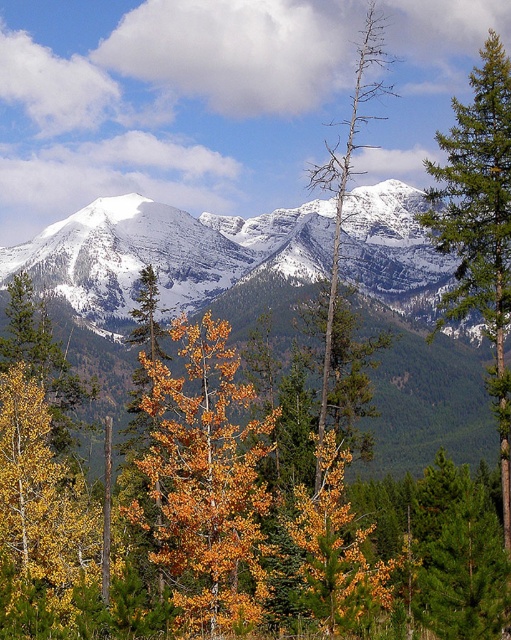
Between yellow leafy tree at center and bare wood tree at center, which one has less height?

Standing shorter between the two is yellow leafy tree at center.

Does yellow leafy tree at center appear on the right side of bare wood tree at center?

Incorrect, yellow leafy tree at center is not on the right side of bare wood tree at center.

Is point (208, 602) positioned after point (368, 120)?

That is False.

Where is `yellow leafy tree at center`? The image size is (511, 640). yellow leafy tree at center is located at coordinates (239, 502).

Can you confirm if yellow leafy tree at center is shorter than orange leafy tree at center?

No, yellow leafy tree at center is not shorter than orange leafy tree at center.

Which is below, yellow leafy tree at center or orange leafy tree at center?

yellow leafy tree at center is below.

Where is `yellow leafy tree at center`? This screenshot has width=511, height=640. yellow leafy tree at center is located at coordinates (239, 502).

Locate an element on the screen. The image size is (511, 640). yellow leafy tree at center is located at coordinates (239, 502).

Can you confirm if snowy granite mountains at center is positioned above green textured pine tree at right?

Yes.

Can you confirm if snowy granite mountains at center is taller than green textured pine tree at right?

Incorrect, snowy granite mountains at center's height is not larger of green textured pine tree at right's.

Find the location of a particular element. The height and width of the screenshot is (640, 511). snowy granite mountains at center is located at coordinates (168, 252).

At what (x,y) coordinates should I click in order to perform the action: click on snowy granite mountains at center. Please return your answer as a coordinate pair (x, y). The width and height of the screenshot is (511, 640). Looking at the image, I should click on (168, 252).